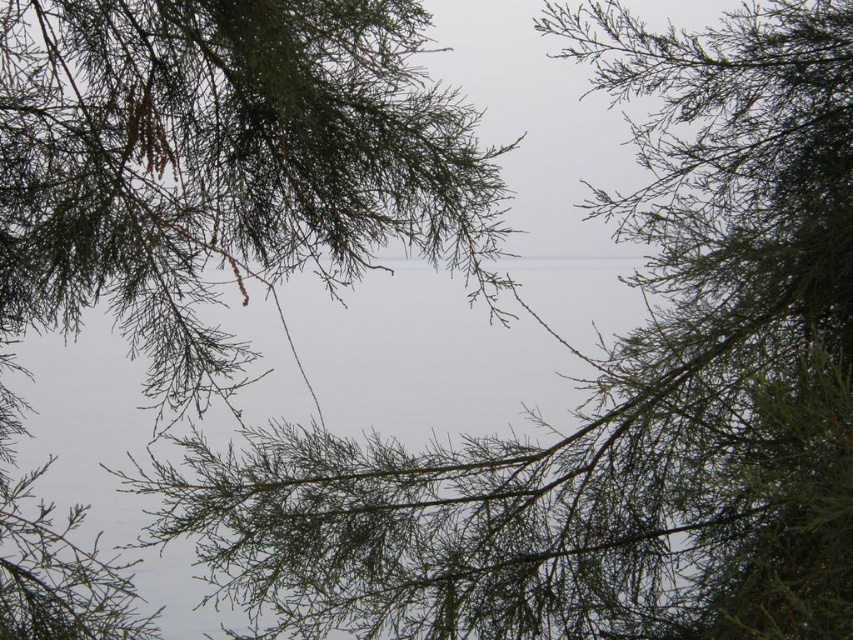
Question: Which object is farther from the camera taking this photo?

Choices:
 (A) green needle-like branches at upper center
 (B) transparent water at center

Answer: (B)

Question: Considering the relative positions of green needle-like branches at upper center and transparent water at center in the image provided, where is green needle-like branches at upper center located with respect to transparent water at center?

Choices:
 (A) above
 (B) below

Answer: (A)

Question: Where is green needle-like branches at upper center located in relation to transparent water at center in the image?

Choices:
 (A) left
 (B) right

Answer: (A)

Question: Among these objects, which one is farthest from the camera?

Choices:
 (A) green needle-like branches at upper center
 (B) transparent water at center

Answer: (B)

Question: Is green needle-like branches at upper center below transparent water at center?

Choices:
 (A) no
 (B) yes

Answer: (A)